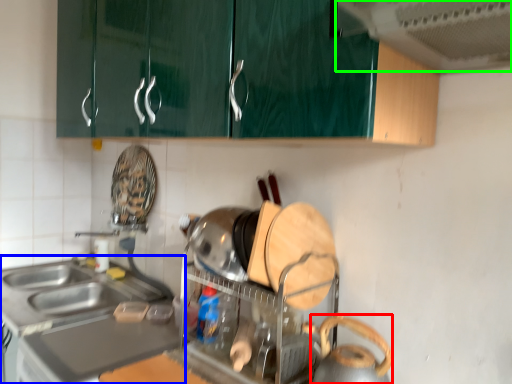
Question: Which object is the closest to the appliance (highlighted by a red box)? Choose among these: countertop (highlighted by a blue box) or exhaust hood (highlighted by a green box).

Choices:
 (A) countertop
 (B) exhaust hood

Answer: (B)